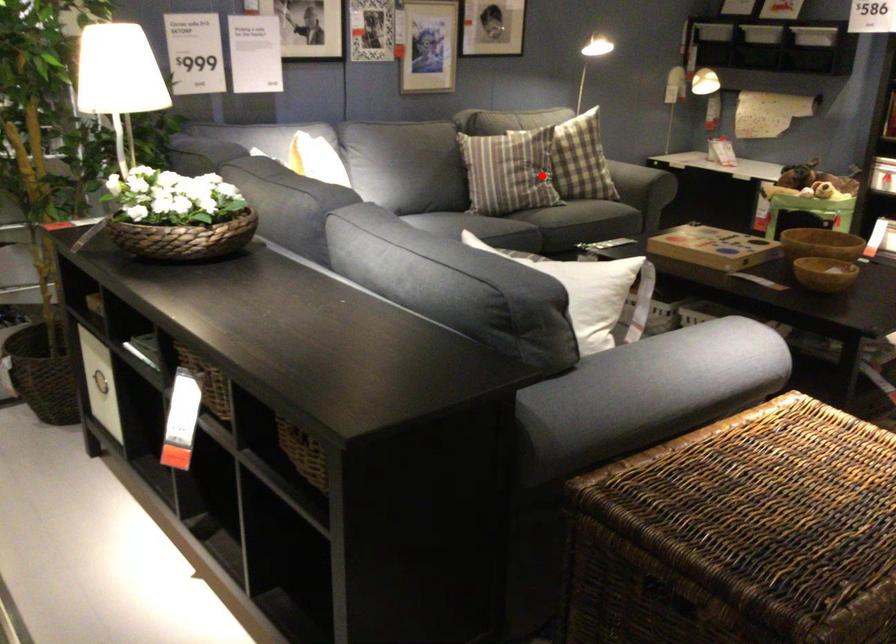
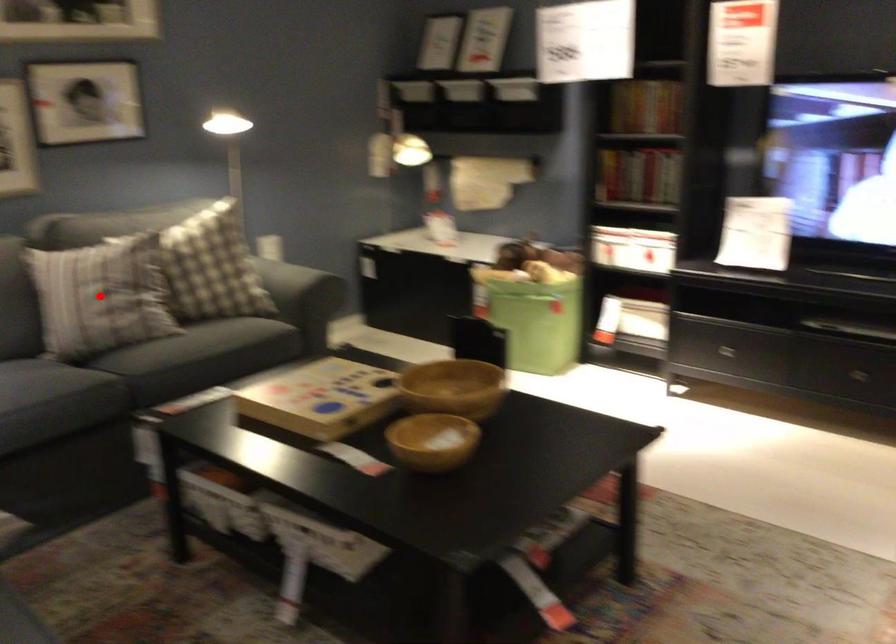
I am providing you with two images of the same scene from different viewpoints. A red point is marked on the first image and another point is marked on the second image. Does the point marked in image1 correspond to the same location as the one in image2?

Yes